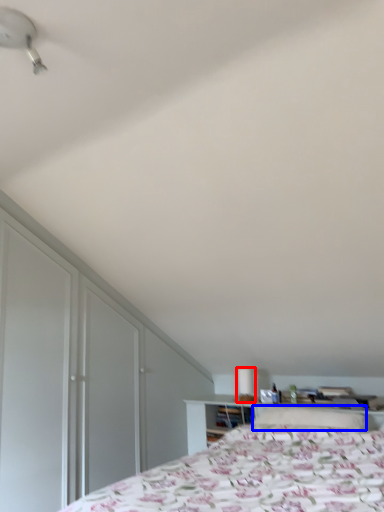
Question: Which point is further to the camera, table lamp (highlighted by a red box) or pillow (highlighted by a blue box)?

Choices:
 (A) table lamp
 (B) pillow

Answer: (A)